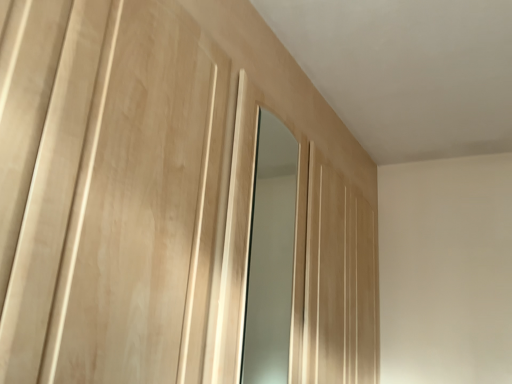
Locate an element on the screen. The image size is (512, 384). matte wooden mirror at center is located at coordinates (271, 255).

This screenshot has height=384, width=512. Describe the element at coordinates (271, 255) in the screenshot. I see `matte wooden mirror at center` at that location.

Image resolution: width=512 pixels, height=384 pixels. I want to click on matte wooden mirror at center, so click(271, 255).